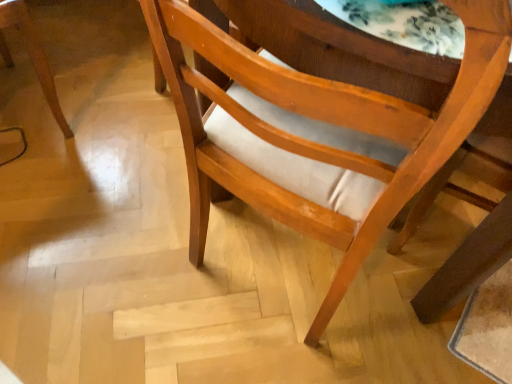
Image resolution: width=512 pixels, height=384 pixels. Find the location of `free space in front of wooden chair at center`. free space in front of wooden chair at center is located at coordinates (279, 349).